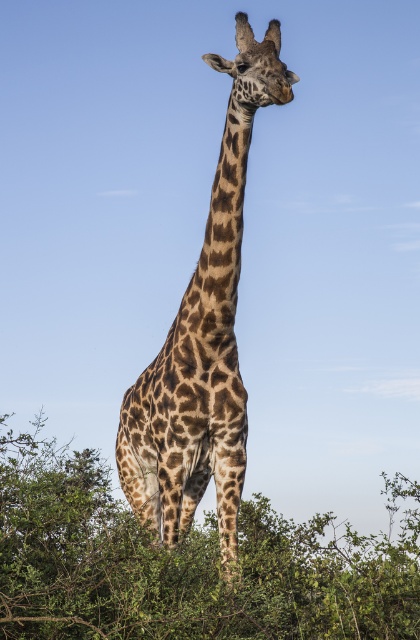
You are a wildlife photographer aiming to capture a photo of the spotted fur giraffe at center. You notice a green leafy bush at center in the background. Based on their heights, will the giraffe be visible above the bush in the photo?

The green leafy bush at center is not as tall as the spotted fur giraffe at center, so the giraffe will be visible above the bush in the photo.

You are a photographer trying to capture the spotted fur giraffe at center. However, there is a green leafy bush at center blocking your view. Can you move to the right to get a clear shot of the giraffe?

The spotted fur giraffe at center is behind the green leafy bush at center, so moving to the right might allow you to see around the bush and get a clearer view of the giraffe.